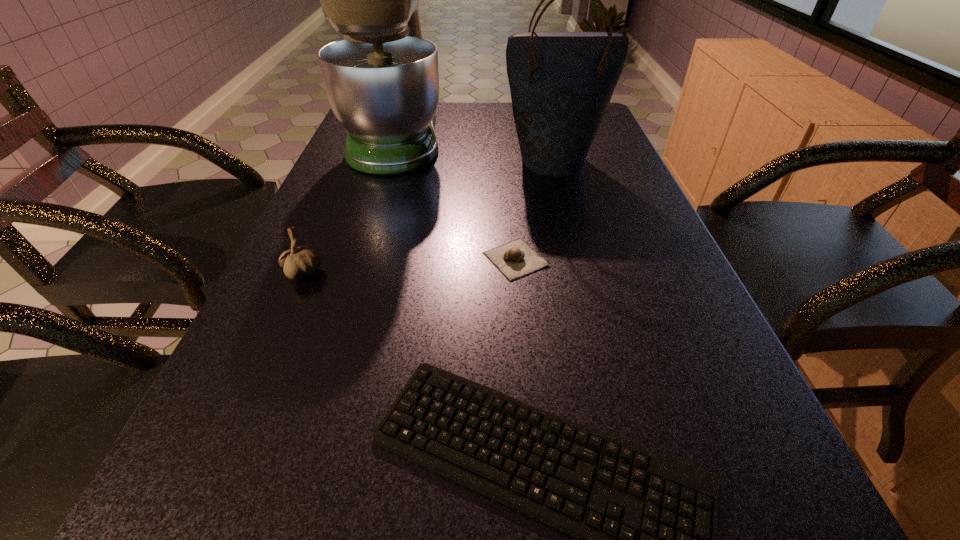
This screenshot has height=540, width=960. Find the location of `vacant area between the shopping bag and the mixer`. vacant area between the shopping bag and the mixer is located at coordinates (475, 149).

The image size is (960, 540). In order to click on free space between the left garlic and the mixer in this screenshot , I will do `click(350, 206)`.

At what (x,y) coordinates should I click in order to perform the action: click on free point between the fourth shortest object and the mixer. Please return your answer as a coordinate pair (x, y). The image size is (960, 540). Looking at the image, I should click on (475, 149).

Locate an element on the screen. The height and width of the screenshot is (540, 960). free space between the mixer and the shopping bag is located at coordinates (475, 149).

This screenshot has height=540, width=960. I want to click on vacant area between the fourth shortest object and the right garlic, so click(x=535, y=210).

What are the coordinates of `free spot between the mixer and the third shortest object` in the screenshot? It's located at (350, 206).

You are a GUI agent. You are given a task and a screenshot of the screen. Output one action in this format:
    pyautogui.click(x=<x>, y=<y>)
    Task: Click on the object that is the fourth closest to the computer keyboard
    The width and height of the screenshot is (960, 540).
    Given the screenshot: What is the action you would take?
    pyautogui.click(x=561, y=83)

I want to click on object that can be found as the third closest to the shopping bag, so coord(298,262).

The image size is (960, 540). What are the coordinates of `free space that satisfies the following two spatial constraints: 1. on the controls of the mixer; 2. on the left side of the shopping bag` in the screenshot? It's located at (390, 160).

Locate an element on the screen. The width and height of the screenshot is (960, 540). vacant space that satisfies the following two spatial constraints: 1. on the controls of the shopping bag; 2. on the right side of the mixer is located at coordinates (390, 160).